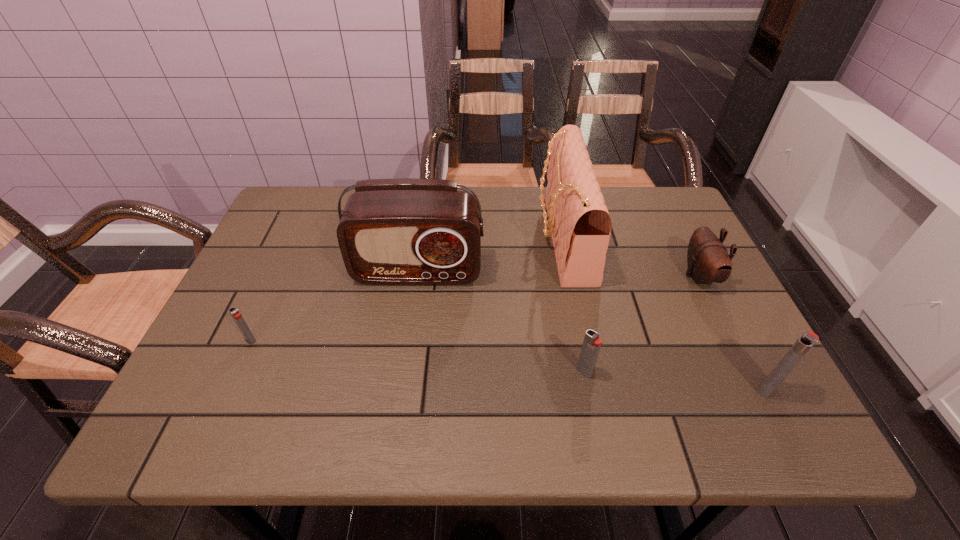
Find the location of `the farthest igniter`. the farthest igniter is located at coordinates (234, 312).

The height and width of the screenshot is (540, 960). Find the location of `the shortest igniter`. the shortest igniter is located at coordinates (234, 312).

The height and width of the screenshot is (540, 960). Identify the location of the second igniter from right to left. (591, 346).

The height and width of the screenshot is (540, 960). Identify the location of the second shortest igniter. (591, 346).

Identify the location of the nearest igniter. (808, 339).

Where is `the third tallest object`? the third tallest object is located at coordinates (808, 339).

Locate an element on the screen. handbag is located at coordinates (579, 222).

This screenshot has height=540, width=960. In order to click on pouch in this screenshot , I will do `click(708, 260)`.

Where is `radio receiver`? The image size is (960, 540). radio receiver is located at coordinates (406, 231).

Where is `free space located 0.370m on the right of the fourth farthest object`? The height and width of the screenshot is (540, 960). free space located 0.370m on the right of the fourth farthest object is located at coordinates (424, 340).